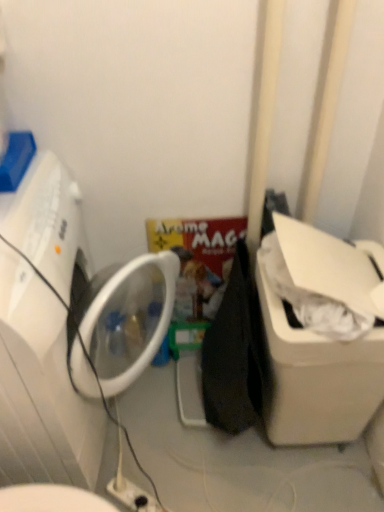
Question: Would you consider white plastic electric outlet at lower center to be distant from white plastic washing machine at left?

Choices:
 (A) no
 (B) yes

Answer: (A)

Question: Is white plastic electric outlet at lower center thinner than white plastic washing machine at left?

Choices:
 (A) no
 (B) yes

Answer: (B)

Question: Can you see white plastic electric outlet at lower center touching white plastic washing machine at left?

Choices:
 (A) no
 (B) yes

Answer: (A)

Question: Is white plastic electric outlet at lower center bigger than white plastic washing machine at left?

Choices:
 (A) no
 (B) yes

Answer: (A)

Question: Is white plastic electric outlet at lower center positioned before white plastic washing machine at left?

Choices:
 (A) no
 (B) yes

Answer: (A)

Question: Is point (46, 151) positioned closer to the camera than point (153, 509)?

Choices:
 (A) closer
 (B) farther

Answer: (A)

Question: Relative to white plastic electric outlet at lower center, is white plastic washing machine at left in front or behind?

Choices:
 (A) front
 (B) behind

Answer: (A)

Question: From the image's perspective, is white plastic washing machine at left above or below white plastic electric outlet at lower center?

Choices:
 (A) below
 (B) above

Answer: (B)

Question: Do you think white plastic washing machine at left is within white plastic electric outlet at lower center, or outside of it?

Choices:
 (A) inside
 (B) outside

Answer: (B)

Question: Would you say white plastic water cooler at right is inside or outside white plastic washing machine at left?

Choices:
 (A) outside
 (B) inside

Answer: (A)

Question: In terms of height, does white plastic water cooler at right look taller or shorter compared to white plastic washing machine at left?

Choices:
 (A) tall
 (B) short

Answer: (B)

Question: From a real-world perspective, is white plastic water cooler at right above or below white plastic washing machine at left?

Choices:
 (A) below
 (B) above

Answer: (A)

Question: Considering their positions, is white plastic water cooler at right located in front of or behind white plastic washing machine at left?

Choices:
 (A) front
 (B) behind

Answer: (B)

Question: Considering the positions of white plastic washing machine at left and white plastic water cooler at right in the image, is white plastic washing machine at left taller or shorter than white plastic water cooler at right?

Choices:
 (A) tall
 (B) short

Answer: (A)

Question: Looking at their shapes, would you say white plastic washing machine at left is wider or thinner than white plastic water cooler at right?

Choices:
 (A) thin
 (B) wide

Answer: (B)